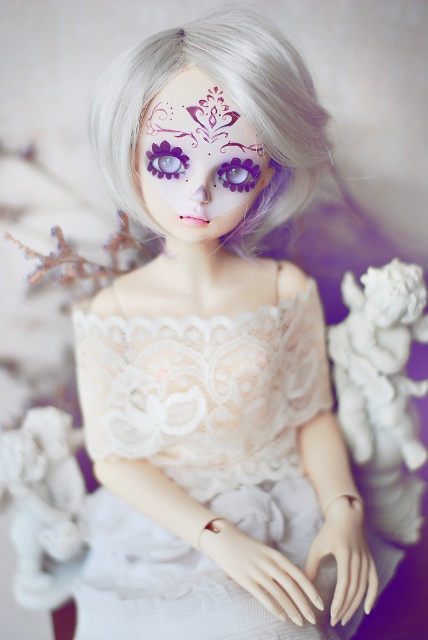
Question: Considering the relative positions of white porcelain cherub at lower right and matte purple face at center in the image provided, where is white porcelain cherub at lower right located with respect to matte purple face at center?

Choices:
 (A) below
 (B) above

Answer: (A)

Question: Estimate the real-world distances between objects in this image. Which object is closer to the purple matte eye at upper left?

Choices:
 (A) lace fabric dress at center
 (B) white matte hair at upper center
 (C) white porcelain cherub at lower right
 (D) matte purple face at center

Answer: (D)

Question: Where is lace fabric dress at center located in relation to matte purple face at center in the image?

Choices:
 (A) left
 (B) right

Answer: (A)

Question: Which object is the closest to the purple glossy eye at center?

Choices:
 (A) matte purple face at center
 (B) lace fabric dress at center
 (C) white matte hair at upper center
 (D) white porcelain cherub at lower right

Answer: (A)

Question: Is white matte hair at upper center smaller than purple glossy eye at center?

Choices:
 (A) yes
 (B) no

Answer: (B)

Question: Which of the following is the farthest from the observer?

Choices:
 (A) (226, 440)
 (B) (422, 449)
 (C) (172, 173)

Answer: (B)